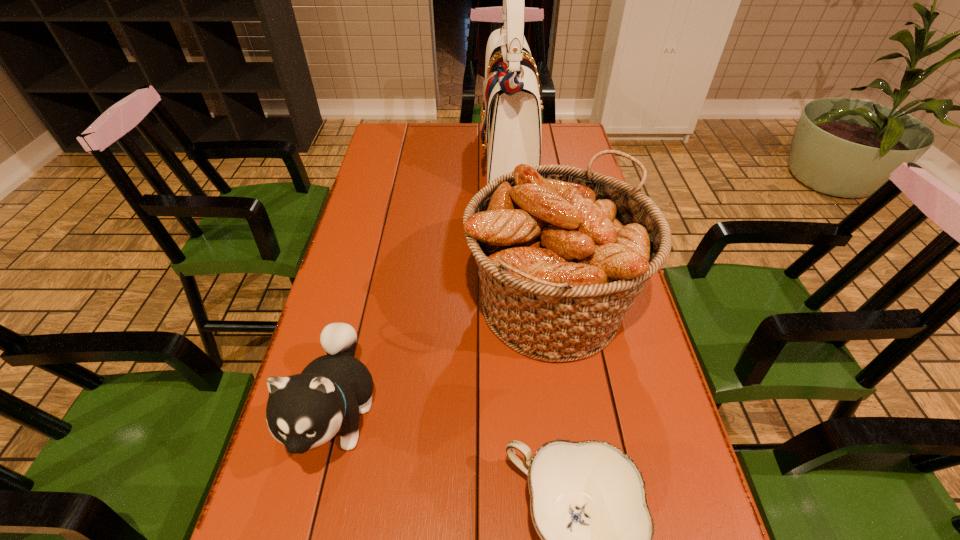
Find the location of a particular element. the second closest object to the third tallest object is located at coordinates (588, 504).

In order to click on the closest object relative to the basket in this screenshot , I will do `click(588, 504)`.

Identify the location of vacant region that satisfies the following two spatial constraints: 1. on the back side of the basket; 2. on the front-facing side of the satchel. (530, 160).

Locate an element on the screen. The width and height of the screenshot is (960, 540). vacant point that satisfies the following two spatial constraints: 1. on the front-facing side of the satchel; 2. at the face of the second shortest object is located at coordinates pyautogui.click(x=531, y=413).

The height and width of the screenshot is (540, 960). Find the location of `free region that satisfies the following two spatial constraints: 1. on the front-facing side of the farthest object; 2. on the right side of the basket`. free region that satisfies the following two spatial constraints: 1. on the front-facing side of the farthest object; 2. on the right side of the basket is located at coordinates (522, 306).